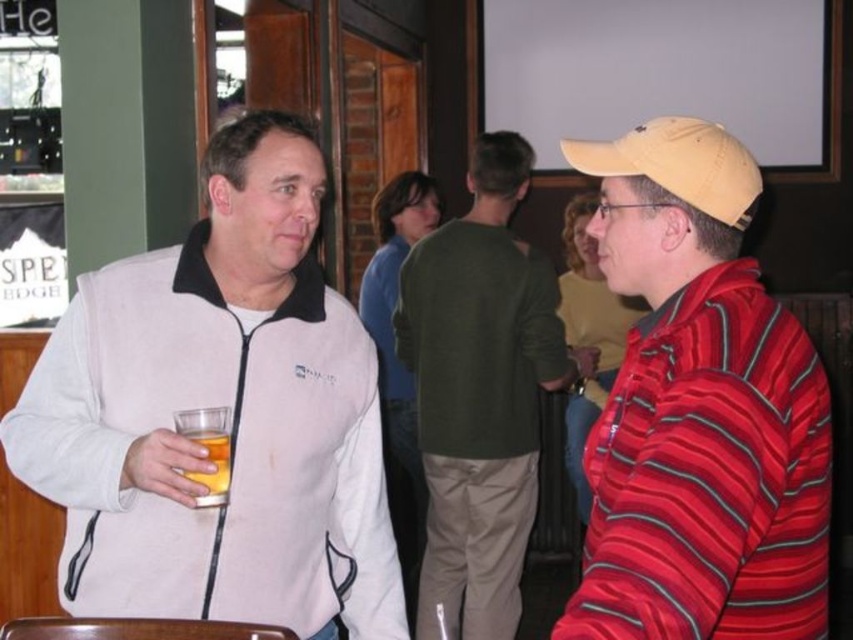
Question: Can you confirm if striped cotton shirt at right is positioned to the left of green cotton sweater at center?

Choices:
 (A) no
 (B) yes

Answer: (A)

Question: Does white fleece jacket at center lie in front of green cotton sweater at center?

Choices:
 (A) yes
 (B) no

Answer: (A)

Question: Is striped cotton shirt at right smaller than green cotton sweater at center?

Choices:
 (A) yes
 (B) no

Answer: (A)

Question: Which point is closer to the camera?

Choices:
 (A) translucent glass beer at left
 (B) striped cotton shirt at right

Answer: (B)

Question: Which of these objects is positioned farthest from the green cotton sweater at center?

Choices:
 (A) striped cotton shirt at right
 (B) white fleece jacket at center

Answer: (A)

Question: Which point appears farthest from the camera in this image?

Choices:
 (A) (672, 417)
 (B) (134, 266)

Answer: (B)